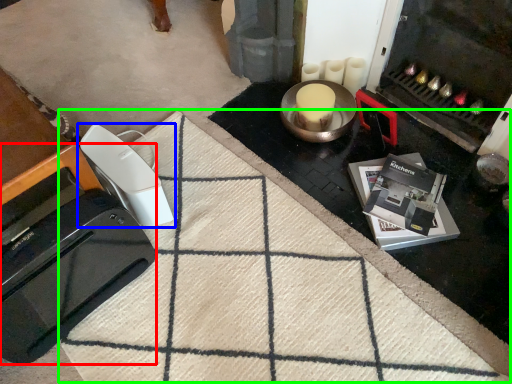
Question: Which object is the farthest from home appliance (highlighted by a red box)? Choose among these: home appliance (highlighted by a blue box) or doormat (highlighted by a green box).

Choices:
 (A) home appliance
 (B) doormat

Answer: (B)